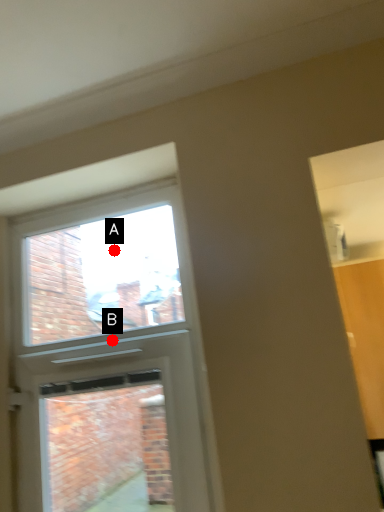
Question: Two points are circled on the image, labeled by A and B beside each circle. Which point is farther from the camera taking this photo?

Choices:
 (A) A is further
 (B) B is further

Answer: (A)